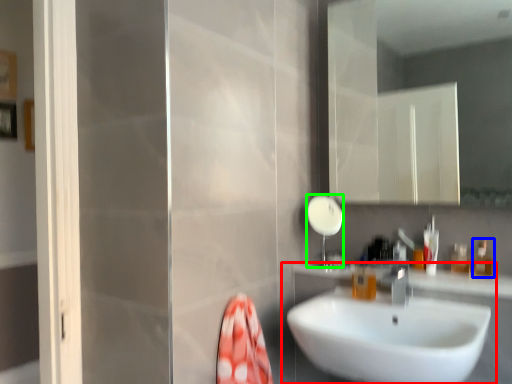
Question: Which object is the closest to the sink (highlighted by a red box)? Choose among these: toiletry (highlighted by a blue box) or shower (highlighted by a green box).

Choices:
 (A) toiletry
 (B) shower

Answer: (B)